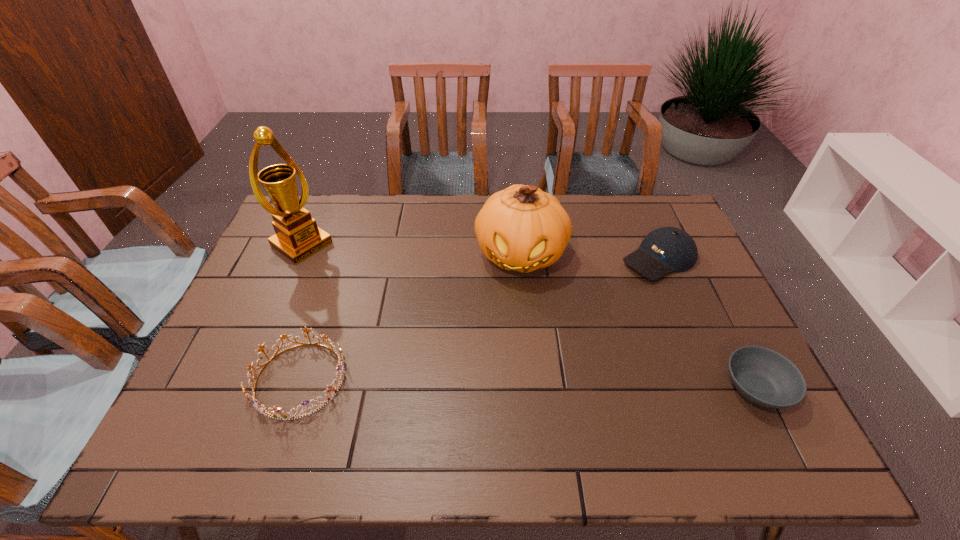
The height and width of the screenshot is (540, 960). I want to click on the second shortest object, so click(x=275, y=412).

Locate an element on the screen. the shortest object is located at coordinates (764, 377).

At what (x,y) coordinates should I click in order to perform the action: click on award. Please return your answer as a coordinate pair (x, y). The image size is (960, 540). Looking at the image, I should click on (297, 237).

You are a GUI agent. You are given a task and a screenshot of the screen. Output one action in this format:
    pyautogui.click(x=<x>, y=<y>)
    Task: Click on the pumpkin
    
    Given the screenshot: What is the action you would take?
    pyautogui.click(x=521, y=228)

Locate an element on the screen. This screenshot has height=540, width=960. the third object from right to left is located at coordinates (521, 228).

Where is `baseball cap`? The height and width of the screenshot is (540, 960). baseball cap is located at coordinates (667, 249).

Identify the location of free space located 0.370m on the back of the shortest object. This screenshot has height=540, width=960. (692, 261).

Locate an element on the screen. vacant space located on the front-facing side of the tallest object is located at coordinates (400, 314).

This screenshot has height=540, width=960. Identify the location of free spot located on the front-facing side of the tallest object. [x=344, y=274].

This screenshot has height=540, width=960. What are the coordinates of `vacant area located 0.390m on the front-facing side of the tallest object` in the screenshot? It's located at point(405,318).